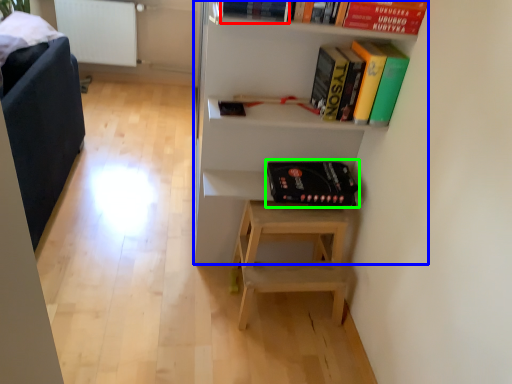
Question: Estimate the real-world distances between objects in this image. Which object is farther from book (highlighted by a red box), shelf (highlighted by a blue box) or paperback book (highlighted by a green box)?

Choices:
 (A) shelf
 (B) paperback book

Answer: (B)